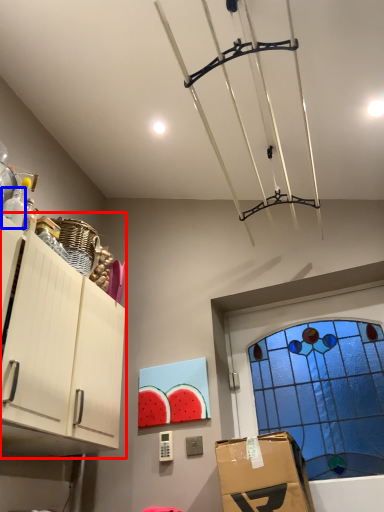
Question: Among these objects, which one is nearest to the camera, cabinetry (highlighted by a red box) or bottle (highlighted by a blue box)?

Choices:
 (A) cabinetry
 (B) bottle

Answer: (A)